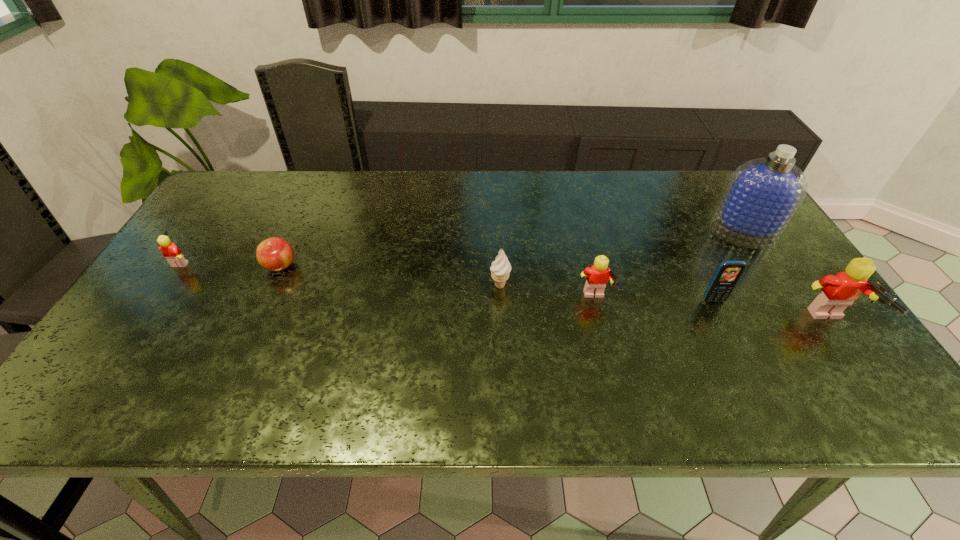
Identify which Lego is located as the third nearest to the third object from left to right. Please provide its 2D coordinates. Your answer should be formatted as a tuple, i.e. [(x, y)], where the tuple contains the x and y coordinates of a point satisfying the conditions above.

[(170, 251)]

Locate an element on the screen. vacant position in the image that satisfies the following two spatial constraints: 1. in front of the shortest Lego with the accessory visible; 2. on the right side of the sixth object from right to left is located at coordinates (179, 266).